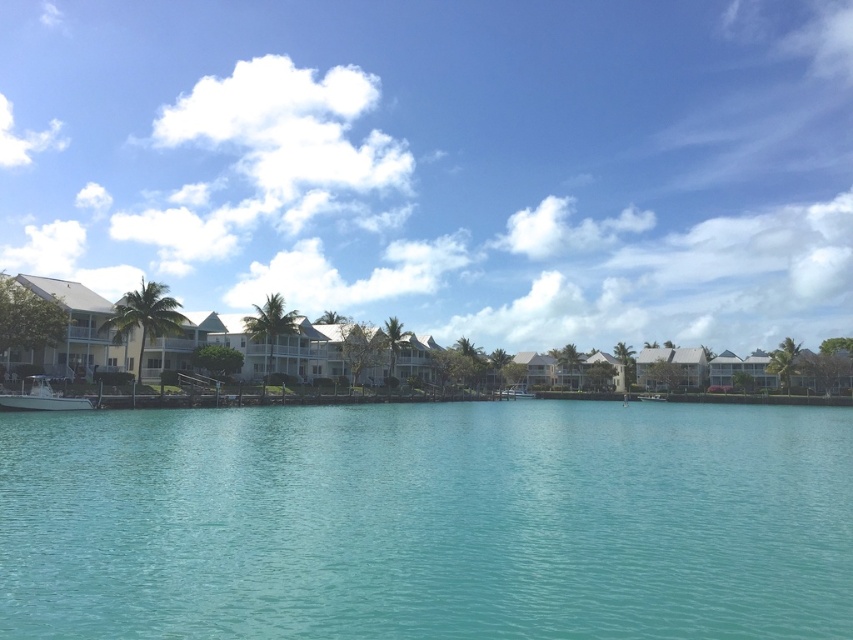
Question: Does clear blue water at center appear under white glossy boat at center?

Choices:
 (A) yes
 (B) no

Answer: (B)

Question: Can you confirm if white fiberglass boat at lower left is bigger than white glossy boat at center?

Choices:
 (A) yes
 (B) no

Answer: (B)

Question: Considering the real-world distances, which object is farthest from the clear blue water at center?

Choices:
 (A) white fiberglass boat at lower left
 (B) white glossy boat at center

Answer: (B)

Question: Which point is farther from the camera taking this photo?

Choices:
 (A) (73, 403)
 (B) (45, 580)
 (C) (653, 400)

Answer: (C)

Question: Is clear blue water at center smaller than white fiberglass boat at lower left?

Choices:
 (A) no
 (B) yes

Answer: (A)

Question: Estimate the real-world distances between objects in this image. Which object is closer to the white fiberglass boat at lower left?

Choices:
 (A) white glossy boat at center
 (B) clear blue water at center

Answer: (B)